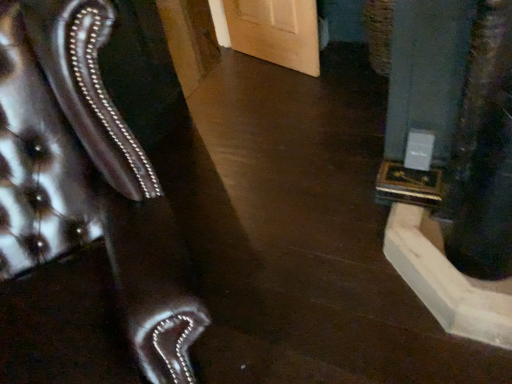
Question: From a real-world perspective, is leather-like brown armchair at left located higher than gray concrete pillar at right?

Choices:
 (A) no
 (B) yes

Answer: (B)

Question: From the image's perspective, is leather-like brown armchair at left located beneath gray concrete pillar at right?

Choices:
 (A) no
 (B) yes

Answer: (B)

Question: Would you say leather-like brown armchair at left is outside gray concrete pillar at right?

Choices:
 (A) yes
 (B) no

Answer: (A)

Question: Is leather-like brown armchair at left aimed at gray concrete pillar at right?

Choices:
 (A) yes
 (B) no

Answer: (B)

Question: Does leather-like brown armchair at left have a larger size compared to gray concrete pillar at right?

Choices:
 (A) no
 (B) yes

Answer: (B)

Question: From the image's perspective, is leather-like brown armchair at left on top of gray concrete pillar at right?

Choices:
 (A) yes
 (B) no

Answer: (B)

Question: From the image's perspective, is gray concrete pillar at right over leather-like brown armchair at left?

Choices:
 (A) yes
 (B) no

Answer: (A)

Question: Would you say leather-like brown armchair at left is part of gray concrete pillar at right's contents?

Choices:
 (A) no
 (B) yes

Answer: (A)

Question: Is gray concrete pillar at right turned away from leather-like brown armchair at left?

Choices:
 (A) yes
 (B) no

Answer: (B)

Question: Does gray concrete pillar at right have a greater width compared to leather-like brown armchair at left?

Choices:
 (A) no
 (B) yes

Answer: (A)

Question: Can you confirm if gray concrete pillar at right is bigger than leather-like brown armchair at left?

Choices:
 (A) yes
 (B) no

Answer: (B)

Question: Considering the relative positions of gray concrete pillar at right and leather-like brown armchair at left in the image provided, is gray concrete pillar at right to the left of leather-like brown armchair at left from the viewer's perspective?

Choices:
 (A) yes
 (B) no

Answer: (B)

Question: From their relative heights in the image, would you say gray concrete pillar at right is taller or shorter than leather-like brown armchair at left?

Choices:
 (A) tall
 (B) short

Answer: (B)